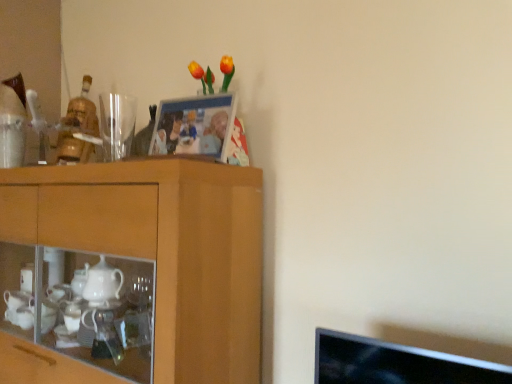
Find the location of a particular element. The image size is (512, 384). wooden cabinet at left is located at coordinates (130, 273).

Identify the location of wooden photo frame at upper center. This screenshot has height=384, width=512. (194, 126).

From a real-world perspective, between wooden cabinet at left and transparent glass at upper left, who is vertically higher?

transparent glass at upper left.

Is point (164, 350) positioned behind point (115, 122)?

No.

Locate an element on the screen. The image size is (512, 384). tableware behind the wooden cabinet at left is located at coordinates (116, 125).

From the image's perspective, would you say transparent glass at upper left is shown under wooden photo frame at upper center?

No.

Relative to wooden photo frame at upper center, is transparent glass at upper left in front or behind?

Clearly, transparent glass at upper left is behind wooden photo frame at upper center.

Is transparent glass at upper left oriented away from wooden photo frame at upper center?

No, transparent glass at upper left is not facing the opposite direction of wooden photo frame at upper center.

How many degrees apart are the facing directions of wooden photo frame at upper center and wooden cabinet at left?

The angular difference between wooden photo frame at upper center and wooden cabinet at left is 1.28 degrees.

Is wooden photo frame at upper center to the left or to the right of wooden cabinet at left in the image?

wooden photo frame at upper center is to the right of wooden cabinet at left.

Is wooden photo frame at upper center positioned far away from wooden cabinet at left?

No.

Considering the sizes of wooden photo frame at upper center and wooden cabinet at left in the image, is wooden photo frame at upper center bigger or smaller than wooden cabinet at left?

Clearly, wooden photo frame at upper center is smaller in size than wooden cabinet at left.

Is wooden cabinet at left next to wooden photo frame at upper center?

They are not placed beside each other.

From the image's perspective, is wooden cabinet at left on wooden photo frame at upper center?

No, from the image's perspective, wooden cabinet at left is not above wooden photo frame at upper center.

Does wooden cabinet at left have a lesser height compared to wooden photo frame at upper center?

In fact, wooden cabinet at left may be taller than wooden photo frame at upper center.

Which object is positioned more to the right, wooden cabinet at left or wooden photo frame at upper center?

wooden photo frame at upper center.

Which of these two, wooden photo frame at upper center or transparent glass at upper left, is wider?

transparent glass at upper left.

In the scene shown: From the image's perspective, is wooden photo frame at upper center positioned above or below transparent glass at upper left?

Clearly, from the image's perspective, wooden photo frame at upper center is below transparent glass at upper left.

Can you tell me how much wooden photo frame at upper center and transparent glass at upper left differ in facing direction?

The angle between the facing direction of wooden photo frame at upper center and the facing direction of transparent glass at upper left is 1.42 degrees.

I want to click on tableware above the wooden photo frame at upper center (from a real-world perspective), so tap(116, 125).

How far apart are transparent glass at upper left and wooden cabinet at left?

transparent glass at upper left and wooden cabinet at left are 21.17 inches apart.

Locate an element on the screen. This screenshot has height=384, width=512. cabinetry on the right of the transparent glass at upper left is located at coordinates (130, 273).

Considering the positions of points (113, 141) and (118, 174), is point (113, 141) farther from camera compared to point (118, 174)?

Yes, point (113, 141) is farther from viewer.

From the picture: Looking at their sizes, would you say transparent glass at upper left is wider or thinner than wooden cabinet at left?

transparent glass at upper left is thinner than wooden cabinet at left.

Locate an element on the screen. tableware on the left of wooden cabinet at left is located at coordinates (116, 125).

At what (x,y) coordinates should I click in order to perform the action: click on tableware behind the wooden photo frame at upper center. Please return your answer as a coordinate pair (x, y). Image resolution: width=512 pixels, height=384 pixels. Looking at the image, I should click on (116, 125).

From the image, which object appears to be nearer to transparent glass at upper left, wooden cabinet at left or wooden photo frame at upper center?

wooden photo frame at upper center.

From the picture: Looking at the image, which one is located closer to wooden photo frame at upper center, wooden cabinet at left or transparent glass at upper left?

The object closer to wooden photo frame at upper center is transparent glass at upper left.

Which object lies nearer to the anchor point wooden cabinet at left, transparent glass at upper left or wooden photo frame at upper center?

wooden photo frame at upper center.

Looking at the image, which one is located further to transparent glass at upper left, wooden photo frame at upper center or wooden cabinet at left?

The object further to transparent glass at upper left is wooden cabinet at left.

Estimate the real-world distances between objects in this image. Which object is further from wooden cabinet at left, wooden photo frame at upper center or transparent glass at upper left?

transparent glass at upper left is positioned further to the anchor wooden cabinet at left.

Which object lies further to the anchor point wooden photo frame at upper center, transparent glass at upper left or wooden cabinet at left?

wooden cabinet at left is further to wooden photo frame at upper center.

The height and width of the screenshot is (384, 512). Identify the location of picture frame between transparent glass at upper left and wooden cabinet at left in the vertical direction. (194, 126).